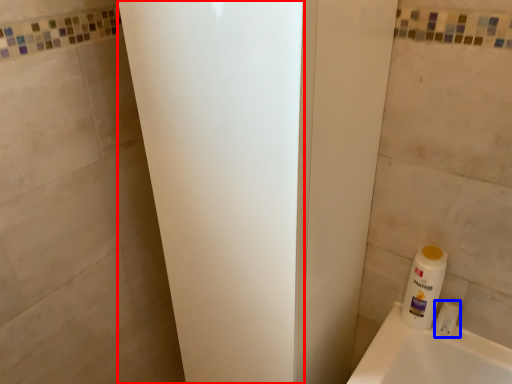
Question: Which of the following is the farthest to the observer, screen door (highlighted by a red box) or toiletry (highlighted by a blue box)?

Choices:
 (A) screen door
 (B) toiletry

Answer: (B)